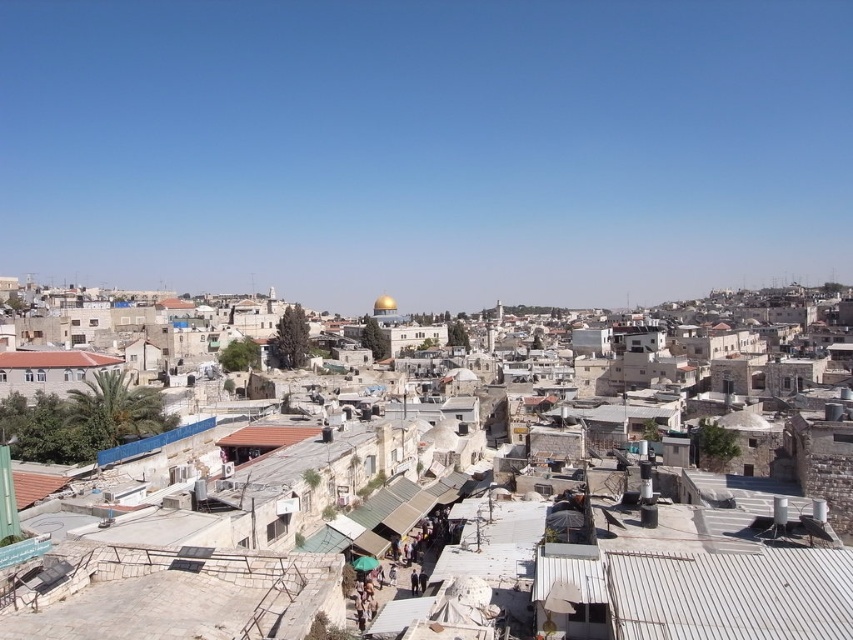
You are a drone operator tasked with capturing aerial footage of the city. Your drone has a maximum flight range of 90 meters from your current position. You want to film both the stone buildings at center and the brown tile roof at lower left. Can your drone cover both locations within its range?

The stone buildings at center and brown tile roof at lower left are 88.00 meters apart. Since the drone can fly up to 90 meters, it can cover both locations within its range.

You are standing in the middle of the urban area shown in the image. There are two points marked in the scene. The first point is at coordinate point (x=637, y=556) and the second is at point (x=100, y=358). Which of these two points is closer to your current position?

Point (x=637, y=556) is closer to the viewer than point (x=100, y=358), so the first point is closer to your current position.